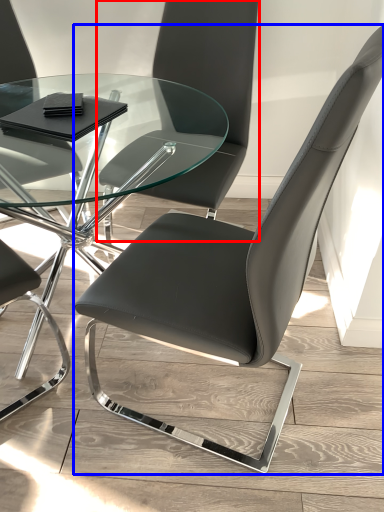
Question: Which object appears farthest to the camera in this image, chair (highlighted by a red box) or chair (highlighted by a blue box)?

Choices:
 (A) chair
 (B) chair

Answer: (A)